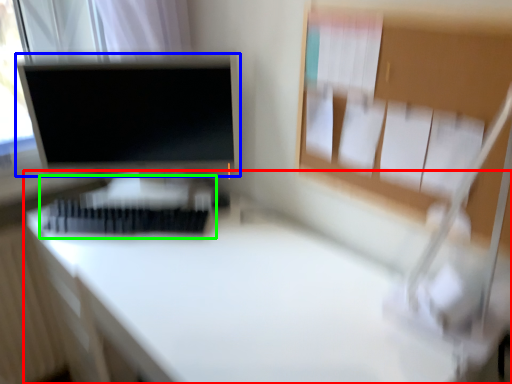
Question: Which object is positioned closest to desk (highlighted by a red box)? Select from computer monitor (highlighted by a blue box) and bed (highlighted by a green box).

Choices:
 (A) computer monitor
 (B) bed

Answer: (B)